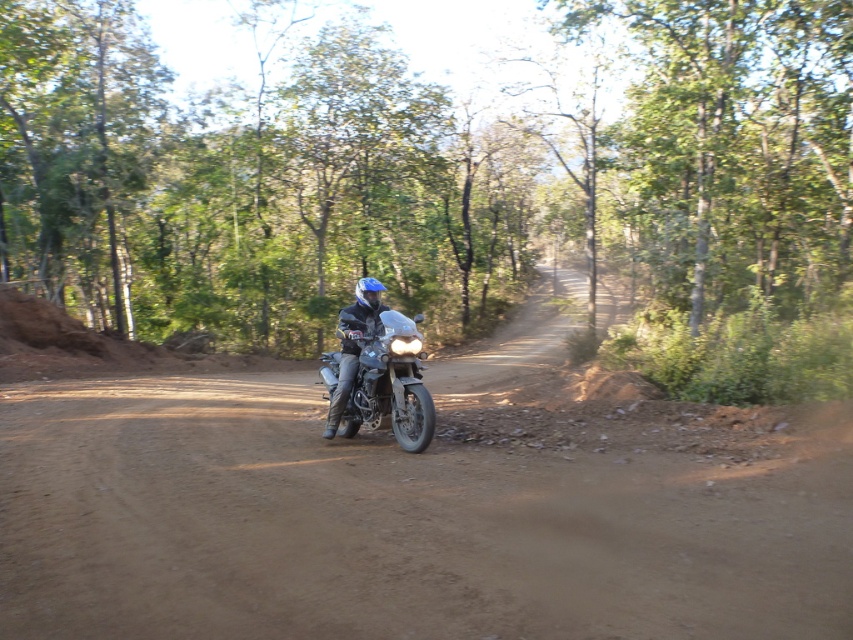
Between point (747, 218) and point (370, 310), which one is positioned behind?

Point (747, 218)

Is point (786, 289) more distant than point (369, 330)?

Yes, it is behind point (369, 330).

The image size is (853, 640). Find the location of `green leafy trees at upper center`. green leafy trees at upper center is located at coordinates click(734, 147).

Is the position of green leafy tree at center more distant than that of brown dirt track at center?

Yes, it is behind brown dirt track at center.

The image size is (853, 640). Find the location of `green leafy tree at center`. green leafy tree at center is located at coordinates (418, 173).

Which is in front, point (267, 218) or point (383, 340)?

Point (383, 340) is more forward.

Who is positioned more to the left, green leafy tree at center or metallic silver motorcycle at center?

metallic silver motorcycle at center is more to the left.

Is point (32, 182) positioned in front of point (387, 310)?

No, (32, 182) is behind (387, 310).

Image resolution: width=853 pixels, height=640 pixels. What are the coordinates of `green leafy tree at center` in the screenshot? It's located at (418, 173).